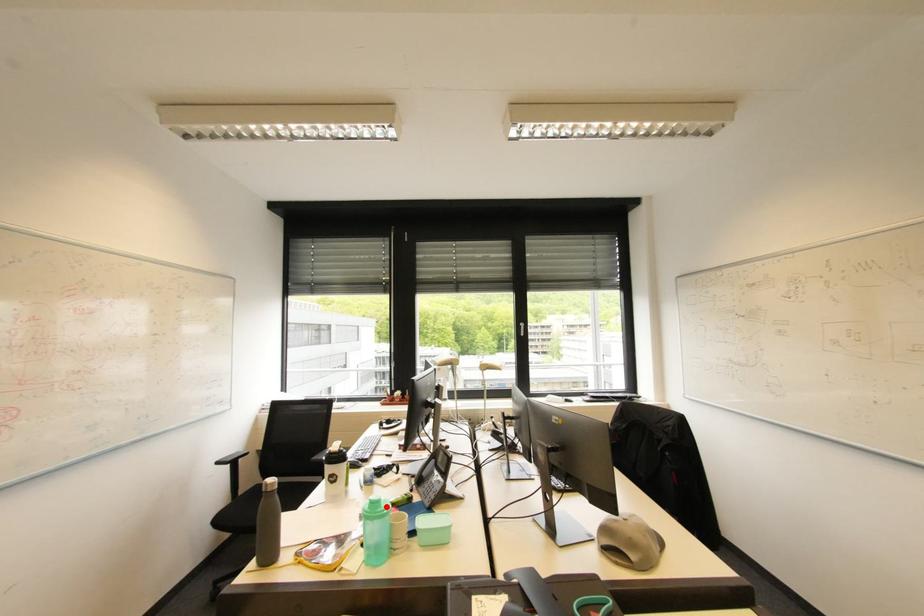
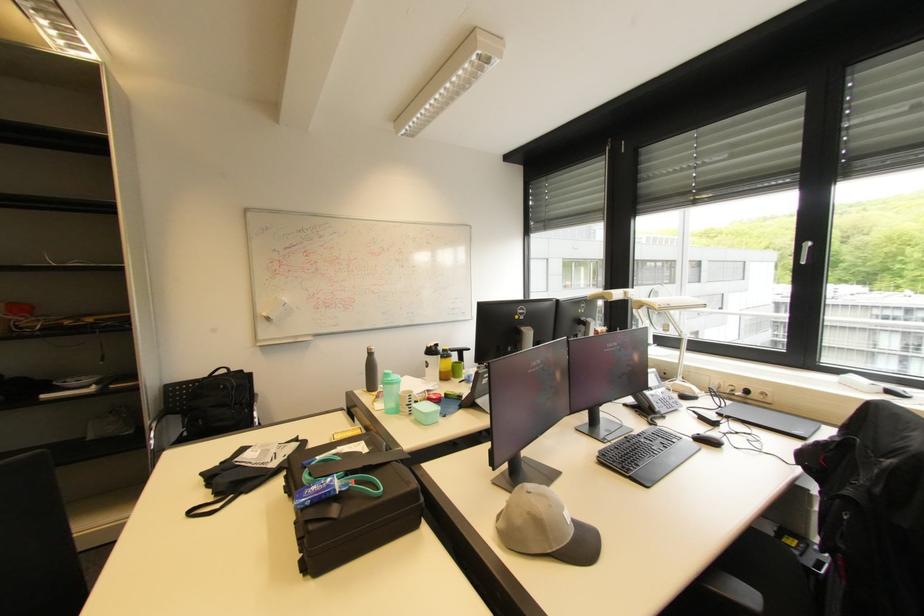
Question: I am providing you with two images of the same scene from different viewpoints. Given a red point in image1, look at the same physical point in image2. Is it:

Choices:
 (A) Closer to the viewpoint
 (B) Farther from the viewpoint

Answer: (B)